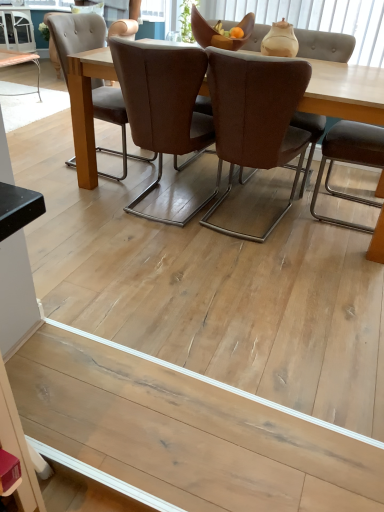
Where is `vacant area that is in front of brown leather chair at right, which ranks as the first chair in right-to-left order`? The height and width of the screenshot is (512, 384). vacant area that is in front of brown leather chair at right, which ranks as the first chair in right-to-left order is located at coordinates (329, 240).